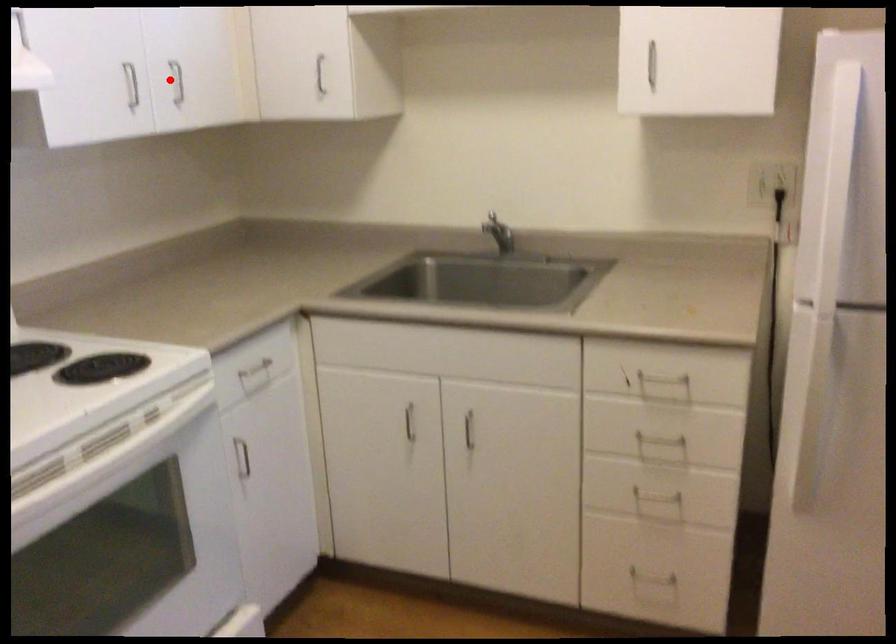
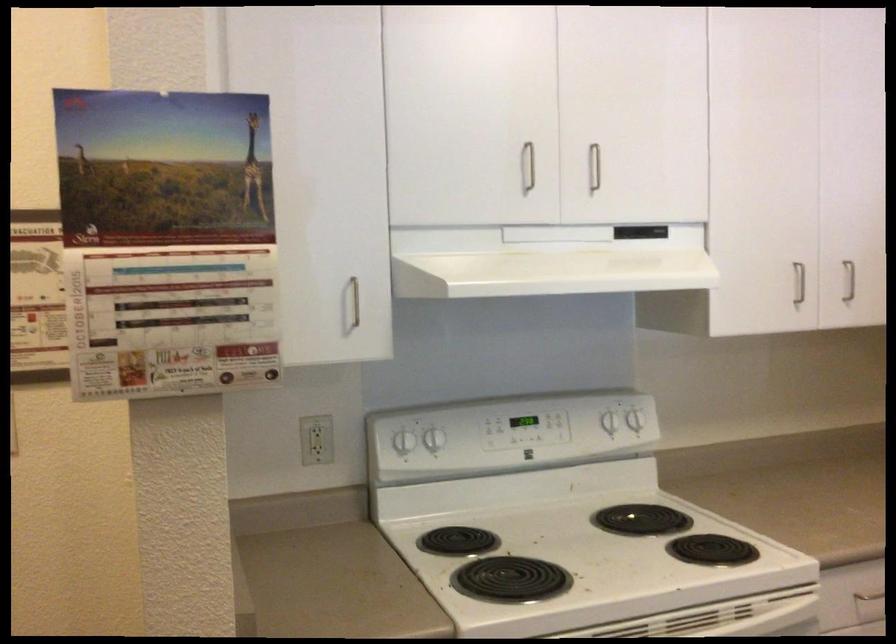
Find the pixel in the second image that matches the highlighted location in the first image.

(849, 281)